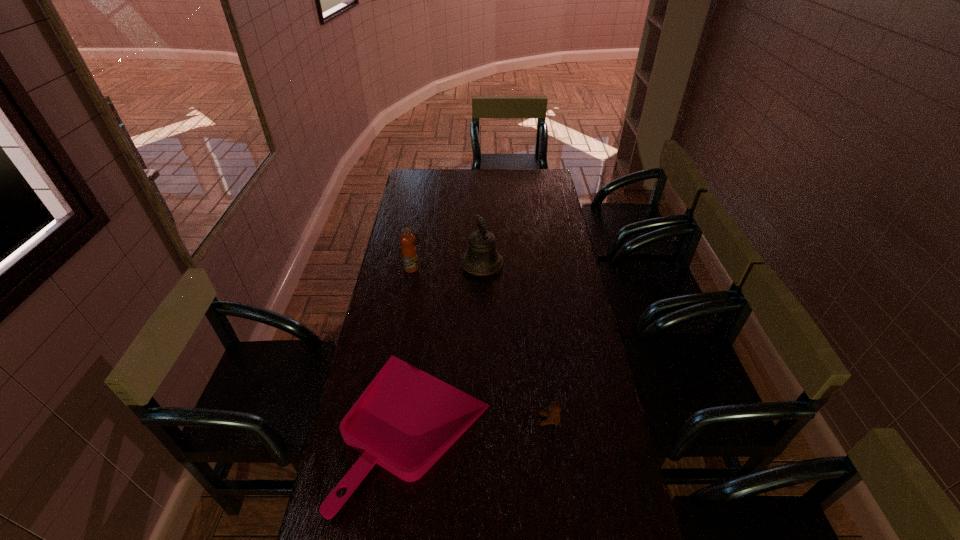
Find the location of a particular element. The height and width of the screenshot is (540, 960). bell is located at coordinates (481, 259).

Find the location of a particular element. fruit juice is located at coordinates (408, 250).

Locate an element on the screen. The image size is (960, 540). the rightmost object is located at coordinates (553, 416).

The image size is (960, 540). I want to click on the third tallest object, so click(553, 416).

At what (x,y) coordinates should I click in order to perform the action: click on dustpan. Please return your answer as a coordinate pair (x, y). Looking at the image, I should click on (406, 419).

Where is `free spot located 0.230m on the right of the bell`? This screenshot has height=540, width=960. free spot located 0.230m on the right of the bell is located at coordinates (557, 265).

You are a GUI agent. You are given a task and a screenshot of the screen. Output one action in this format:
    pyautogui.click(x=<x>, y=<y>)
    Task: Click on the vacant space located on the front of the fruit juice
    The height and width of the screenshot is (540, 960).
    Given the screenshot: What is the action you would take?
    coord(400,330)

Identify the location of vacant space situated on the face of the teddy bear. (449, 420).

Find the location of a particular element. The height and width of the screenshot is (540, 960). vacant region located 0.230m on the face of the teddy bear is located at coordinates (466, 420).

The height and width of the screenshot is (540, 960). I want to click on free space located on the face of the teddy bear, so click(443, 420).